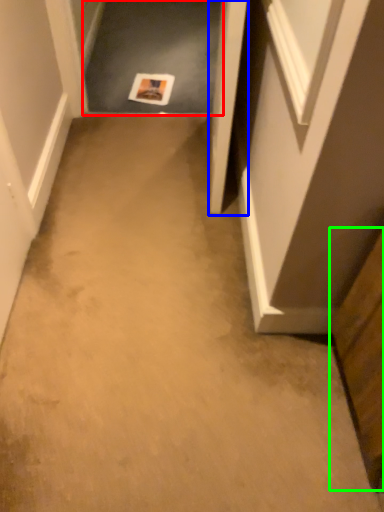
Question: Based on their relative distances, which object is nearer to passage (highlighted by a red box)? Choose from door (highlighted by a blue box) and cabinetry (highlighted by a green box).

Choices:
 (A) door
 (B) cabinetry

Answer: (A)